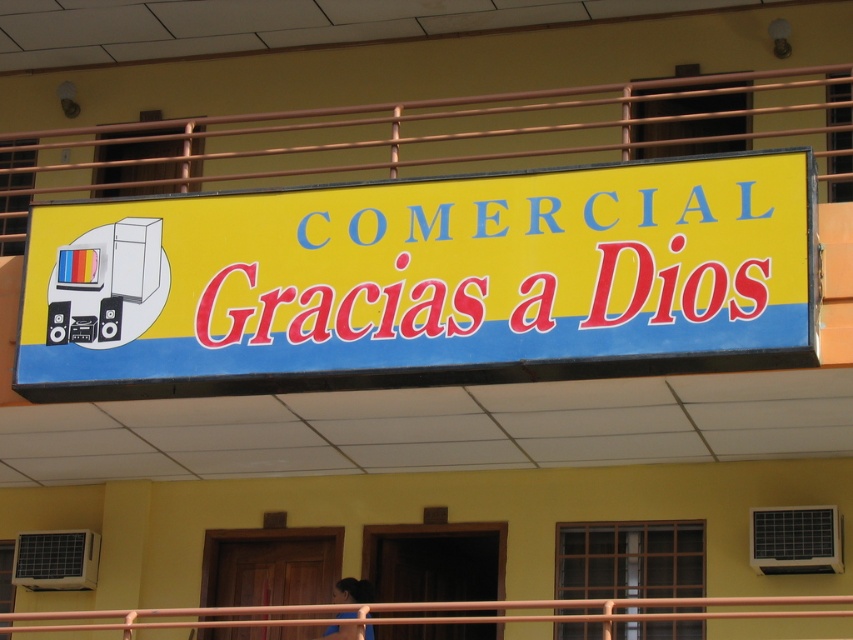
Question: Can you confirm if yellow matte signboard at center is positioned above brown metal rail at center?

Choices:
 (A) yes
 (B) no

Answer: (A)

Question: Estimate the real-world distances between objects in this image. Which object is farther from the yellow matte signboard at center?

Choices:
 (A) brown metal railing at upper center
 (B) dark brown hair at lower center
 (C) brown metal rail at center

Answer: (B)

Question: Does brown metal railing at upper center have a larger size compared to brown metal rail at center?

Choices:
 (A) yes
 (B) no

Answer: (B)

Question: Does brown metal railing at upper center have a smaller size compared to dark brown hair at lower center?

Choices:
 (A) yes
 (B) no

Answer: (B)

Question: Considering the real-world distances, which object is farthest from the brown metal railing at upper center?

Choices:
 (A) yellow matte signboard at center
 (B) brown metal rail at center

Answer: (B)

Question: Which point is farther to the camera?

Choices:
 (A) brown metal rail at center
 (B) dark brown hair at lower center
 (C) brown metal railing at upper center

Answer: (B)